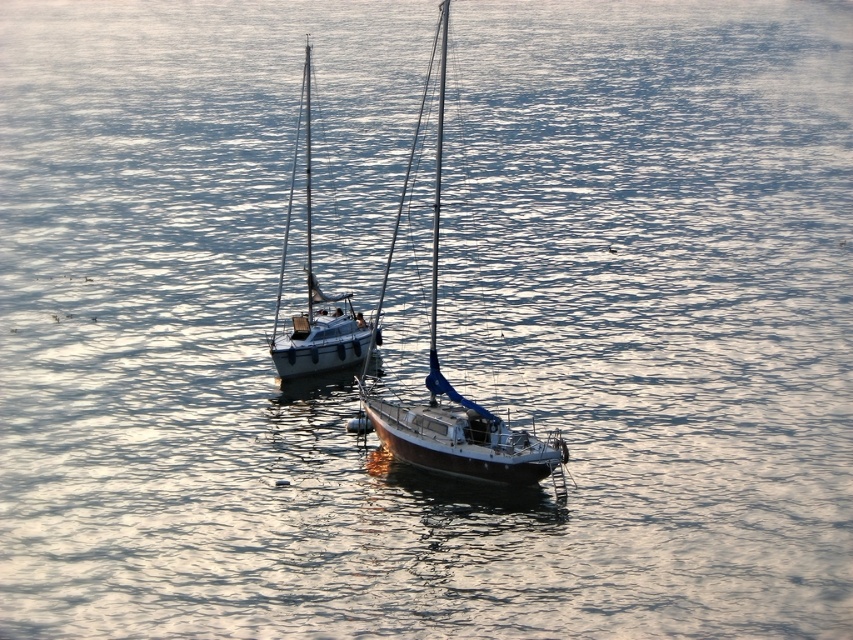
From the picture: You are a marine biologist observing the two objects in the scene. You need to determine if the white glossy sailboat at center can fit through a narrow channel that is exactly as wide as the blue glossy mast at center. Can it pass through?

The white glossy sailboat at center might be wider than the blue glossy mast at center, so it may not be able to pass through the channel safely.

You are standing on the dock and want to board the wooden sailboat at center. If your rowboat can travel 50 meters before needing to refuel, do you think you can reach it without refueling?

The wooden sailboat at center is 42.77 meters away from the viewer. Since your rowboat can travel 50 meters before needing to refuel, you can reach the wooden sailboat at center without needing to refuel.

You are a photographer planning to take a photo of both the wooden sailboat at center and the white glossy sailboat at center. Since you want to emphasize their size difference, which boat should you position closer to the camera to make them appear the same size in the photo?

To make the wooden sailboat at center and the white glossy sailboat at center appear the same size in the photo, you should position the smaller white glossy sailboat at center closer to the camera since it is smaller than the wooden sailboat at center.